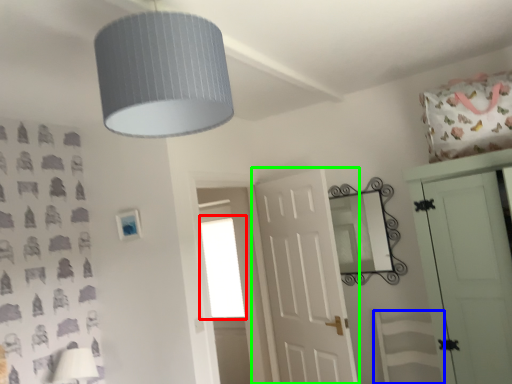
Question: Which is nearer to the window (highlighted by a red box)? swivel chair (highlighted by a blue box) or door (highlighted by a green box).

Choices:
 (A) swivel chair
 (B) door

Answer: (B)